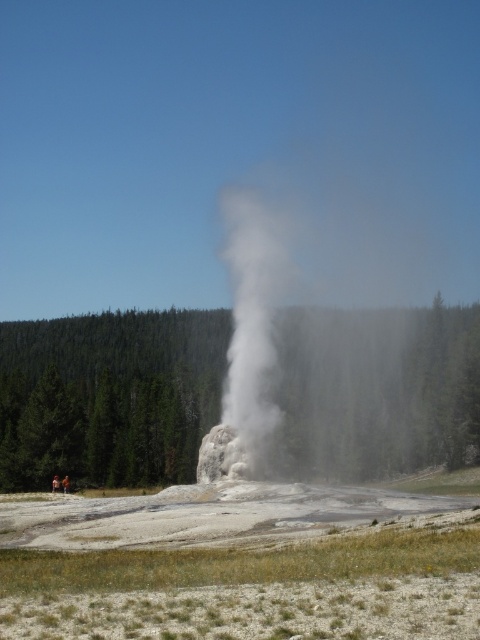
Who is positioned more to the right, green textured tree at center or white vapor at center?

white vapor at center is more to the right.

What do you see at coordinates (108, 396) in the screenshot? The width and height of the screenshot is (480, 640). I see `green textured tree at center` at bounding box center [108, 396].

Find the location of `green textured tree at center`. green textured tree at center is located at coordinates (108, 396).